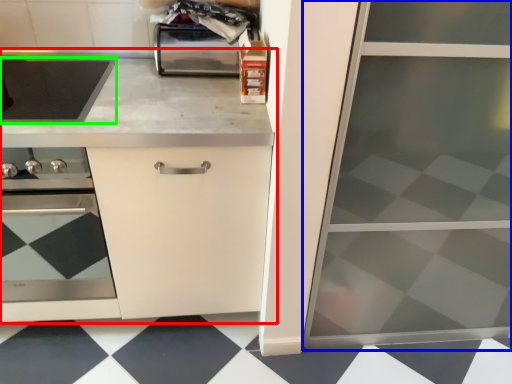
Question: Considering the real-world distances, which object is closest to countertop (highlighted by a red box)? screen door (highlighted by a blue box) or kitchen appliance (highlighted by a green box).

Choices:
 (A) screen door
 (B) kitchen appliance

Answer: (B)